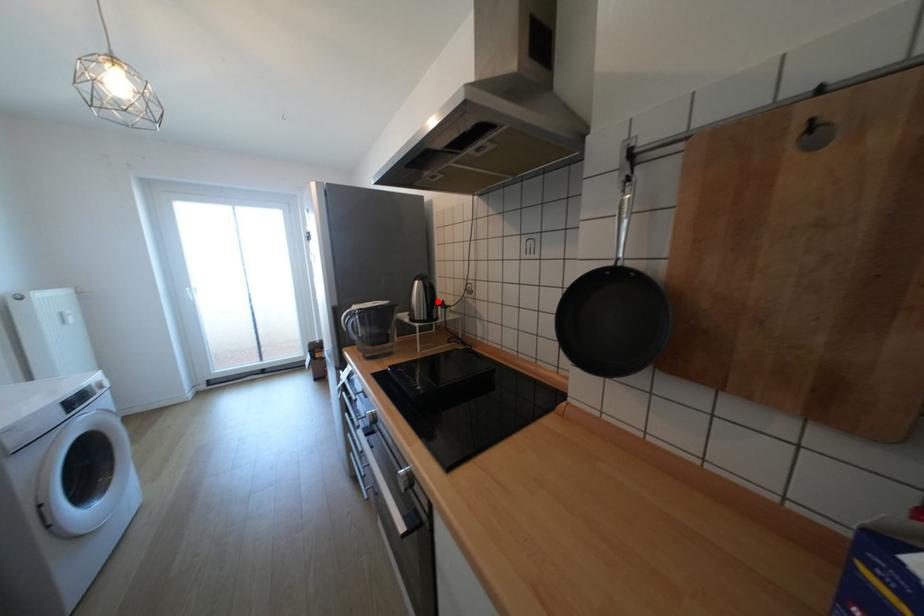
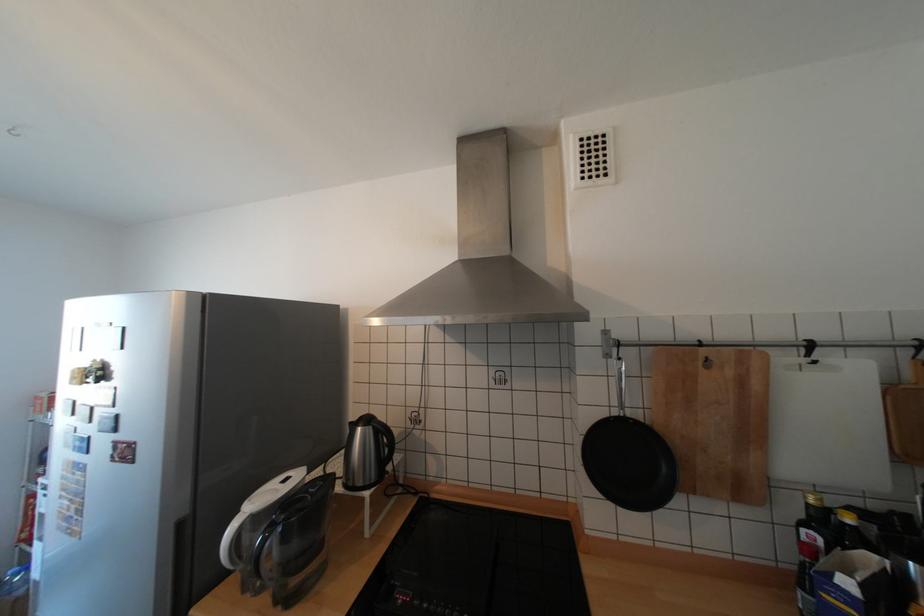
Find the pixel in the second image that matches the highlighted location in the first image.

(392, 453)